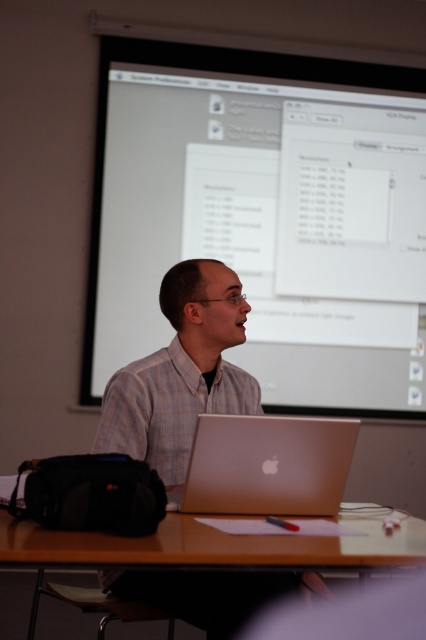
You are sitting at the back of the classroom and want to place a book on the brown wooden table at center and the satin gold laptop at center. Which object is closer to you so you can reach it easily?

The brown wooden table at center is closer to the viewer than the satin gold laptop at center, so you can reach it more easily.

You are organizing a classroom event and need to place a 1.5 meter long banner on the brown wooden table at center. Considering the size of the satin gold laptop at center already on the table, will the banner fit horizontally on the table without overlapping the laptop?

The brown wooden table at center is wider than the satin gold laptop at center, so the banner can be placed horizontally on the table without overlapping the laptop as long as it is positioned appropriately.